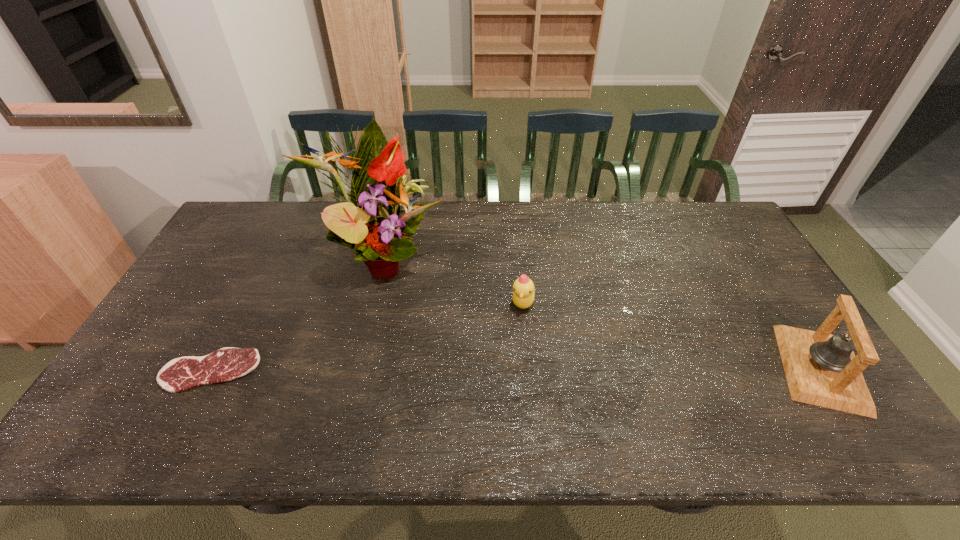
Locate an element on the screen. The width and height of the screenshot is (960, 540). free area in between the second tallest object and the bouquet is located at coordinates (602, 314).

The image size is (960, 540). I want to click on free space between the second object from left to right and the bell, so click(602, 314).

What are the coordinates of `vacant space in between the third shortest object and the leftmost object` in the screenshot? It's located at (516, 369).

Identify the location of free space between the third object from left to right and the rightmost object. (672, 335).

Identify the location of vacant space in between the shortest object and the bouquet. (297, 315).

Where is `free spot between the second object from right to left and the rightmost object`? free spot between the second object from right to left and the rightmost object is located at coordinates (672, 335).

The image size is (960, 540). Identify the location of free space between the third tallest object and the third object from right to left. pos(453,281).

This screenshot has width=960, height=540. What are the coordinates of `vacant area that lies between the second object from right to left and the second object from left to right` in the screenshot? It's located at (453, 281).

At what (x,y) coordinates should I click in order to perform the action: click on the closest object relative to the second object from right to left. Please return your answer as a coordinate pair (x, y). The image size is (960, 540). Looking at the image, I should click on (369, 223).

Select which object is the third closest to the steak. Please provide its 2D coordinates. Your answer should be formatted as a tuple, i.e. [(x, y)], where the tuple contains the x and y coordinates of a point satisfying the conditions above.

[(821, 369)]